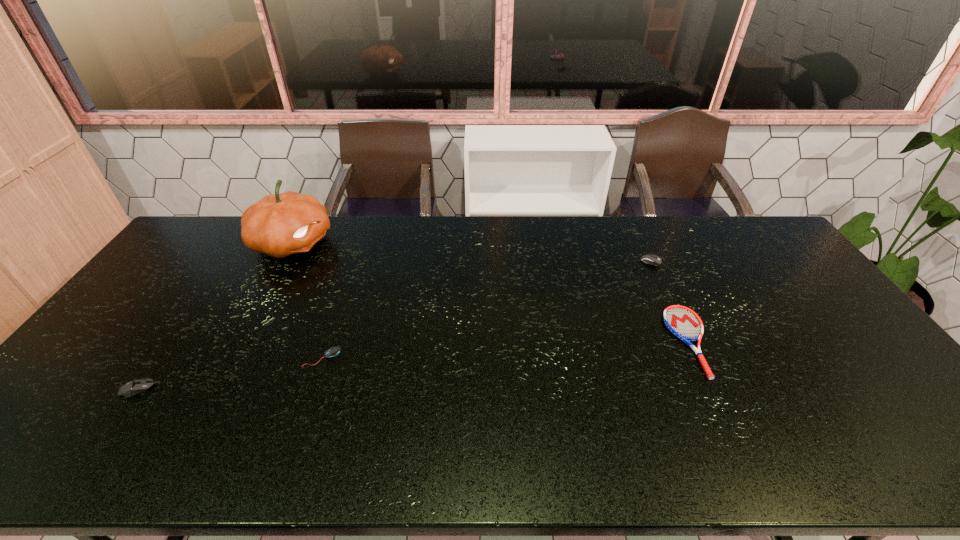
Locate an element on the screen. Image resolution: width=960 pixels, height=540 pixels. vacant space located 0.380m on the left of the tennis racket is located at coordinates (535, 341).

I want to click on vacant space situated on the front of the third object from left to right, so click(x=295, y=437).

This screenshot has width=960, height=540. Find the location of `pumpkin located at the far edge`. pumpkin located at the far edge is located at coordinates (279, 225).

Identify the location of computer mouse that is at the far edge. (650, 259).

Where is `object that is at the left edge`? The width and height of the screenshot is (960, 540). object that is at the left edge is located at coordinates (133, 387).

You are a GUI agent. You are given a task and a screenshot of the screen. Output one action in this format:
    pyautogui.click(x=<x>, y=<y>)
    Task: Click on the vacant region at the far edge of the desktop
    Image resolution: width=960 pixels, height=540 pixels.
    Given the screenshot: What is the action you would take?
    pyautogui.click(x=651, y=217)

Locate an element on the screen. free space at the near edge is located at coordinates (754, 470).

In the image, there is a desktop. At what (x,y) coordinates should I click in order to perform the action: click on vacant space at the right edge. Please return your answer as a coordinate pair (x, y). Looking at the image, I should click on (823, 340).

The width and height of the screenshot is (960, 540). I want to click on blank space at the near left corner of the desktop, so click(9, 467).

Image resolution: width=960 pixels, height=540 pixels. I want to click on vacant space at the far right corner of the desktop, so click(x=746, y=222).